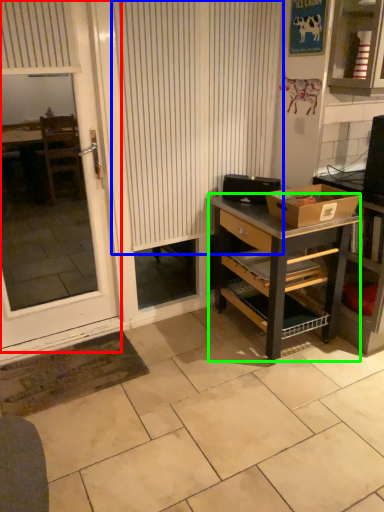
Question: Estimate the real-world distances between objects in this image. Which object is farther from screen door (highlighted by a red box), curtain (highlighted by a blue box) or desk (highlighted by a green box)?

Choices:
 (A) curtain
 (B) desk

Answer: (B)